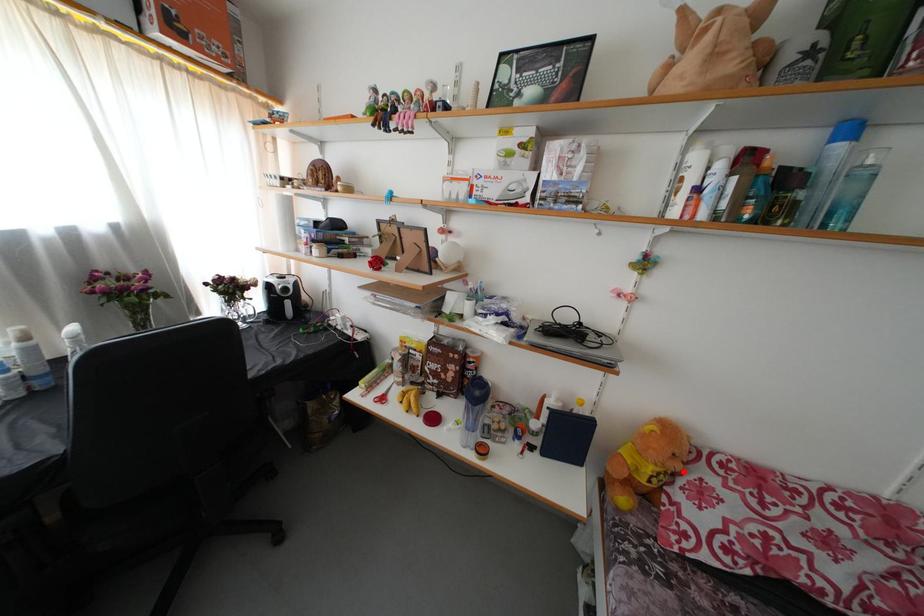
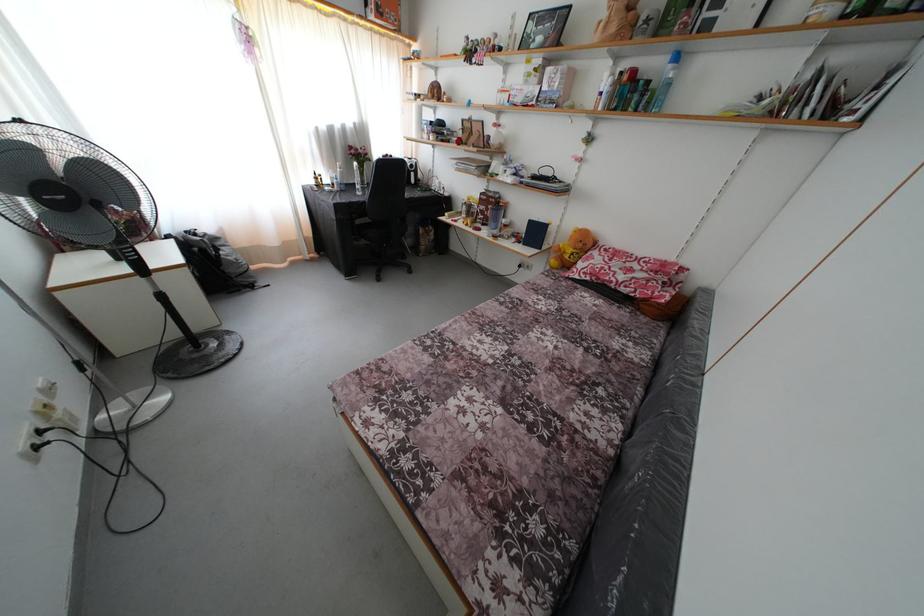
Where in the second image is the point corresponding to the highlighted location from the first image?

(585, 251)